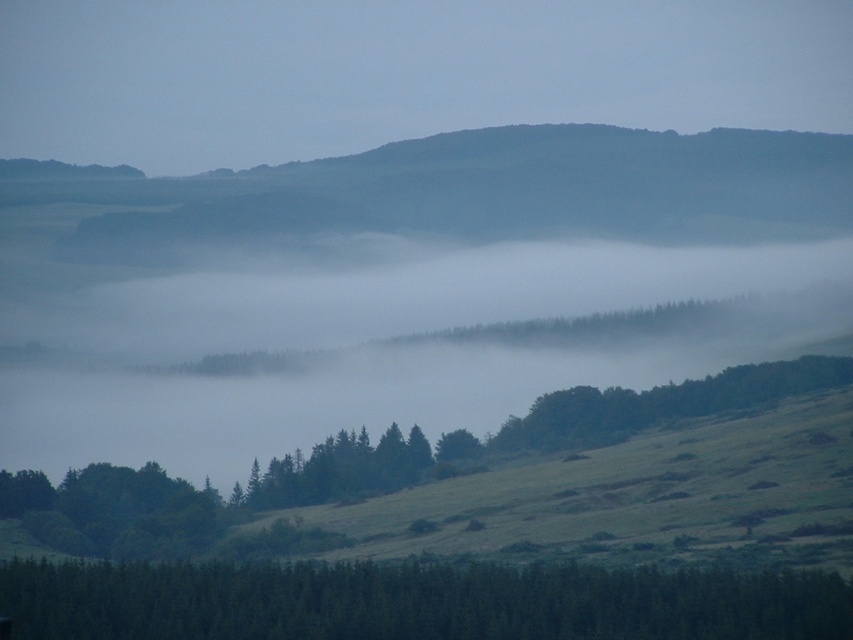
You are standing on the grassy slope in the foreground of the landscape. You notice two points marked in the scene. Which point, point (173, 620) or point (148, 474), is closer to you?

Point (173, 620) is closer to the viewer than point (148, 474).

You are a hiker trying to navigate through the misty valley. You notice two green matte trees in the foreground. Which tree, the green matte tree at lower center or the green matte tree at lower left, would provide more shade if you want to rest under it?

The green matte tree at lower center might provide more shade than the green matte tree at lower left because it is wider according to the description.